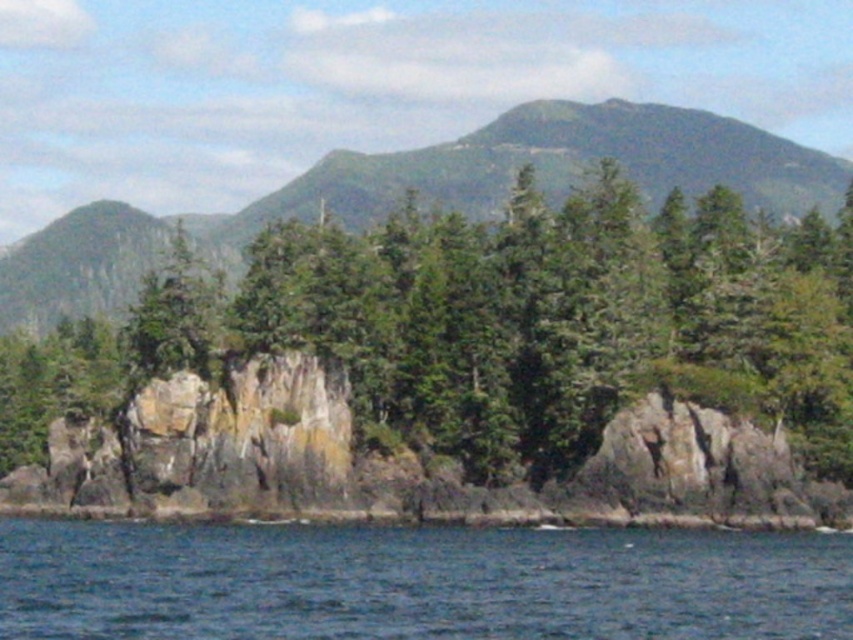
Question: Is green rough rock at center positioned before blue water at lower left?

Choices:
 (A) yes
 (B) no

Answer: (B)

Question: Which object is positioned closest to the green rough rock at center?

Choices:
 (A) green textured mountain at upper center
 (B) blue water at lower left

Answer: (B)

Question: Does blue water at lower left appear on the right side of green textured mountain at upper center?

Choices:
 (A) yes
 (B) no

Answer: (A)

Question: Which object is the closest to the green rough rock at center?

Choices:
 (A) blue water at lower left
 (B) green textured mountain at upper center

Answer: (A)

Question: Is green rough rock at center thinner than green textured mountain at upper center?

Choices:
 (A) no
 (B) yes

Answer: (B)

Question: Which of the following is the closest to the observer?

Choices:
 (A) (57, 257)
 (B) (381, 612)
 (C) (374, 445)

Answer: (B)